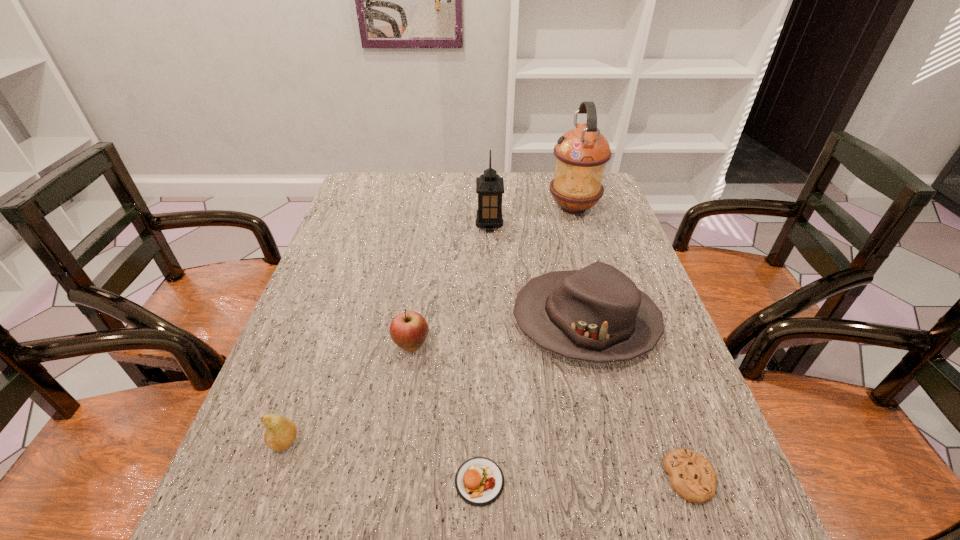
Locate an element on the screen. The width and height of the screenshot is (960, 540). free space in the image that satisfies the following two spatial constraints: 1. on the front side of the patty (food); 2. on the right side of the pear is located at coordinates (271, 481).

The image size is (960, 540). What are the coordinates of `free spot that satisfies the following two spatial constraints: 1. on the front side of the cookie; 2. on the right side of the pear` in the screenshot? It's located at (272, 478).